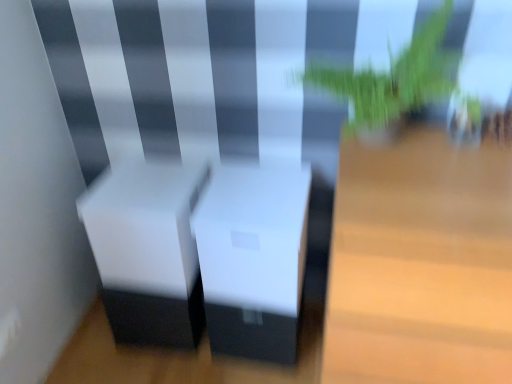
Question: Is white matte table at center, which is counted as the 1th table, starting from the left, to the right of green leafy plant at upper right from the viewer's perspective?

Choices:
 (A) yes
 (B) no

Answer: (B)

Question: Does white matte table at center, which is counted as the 1th table, starting from the left, come in front of green leafy plant at upper right?

Choices:
 (A) yes
 (B) no

Answer: (B)

Question: Can you confirm if white matte table at center, positioned as the second table in right-to-left order, is wider than green leafy plant at upper right?

Choices:
 (A) no
 (B) yes

Answer: (B)

Question: From a real-world perspective, is white matte table at center, which is counted as the 1th table, starting from the left, under green leafy plant at upper right?

Choices:
 (A) no
 (B) yes

Answer: (B)

Question: Is white matte table at center, which is counted as the 1th table, starting from the left, with green leafy plant at upper right?

Choices:
 (A) no
 (B) yes

Answer: (A)

Question: Is point (421, 51) positioned closer to the camera than point (287, 311)?

Choices:
 (A) closer
 (B) farther

Answer: (A)

Question: In the image, is green leafy plant at upper right positioned in front of or behind white matte table at center, which is counted as the 1th table, starting from the left?

Choices:
 (A) front
 (B) behind

Answer: (A)

Question: Considering the positions of green leafy plant at upper right and white matte table at center, positioned as the second table in right-to-left order, in the image, is green leafy plant at upper right taller or shorter than white matte table at center, positioned as the second table in right-to-left order,?

Choices:
 (A) tall
 (B) short

Answer: (A)

Question: Is green leafy plant at upper right bigger or smaller than white matte table at center, positioned as the second table in right-to-left order?

Choices:
 (A) small
 (B) big

Answer: (B)

Question: Relative to light wood table at center, positioned as the second table in left-to-right order, is green leafy plant at upper right in front or behind?

Choices:
 (A) behind
 (B) front

Answer: (A)

Question: Considering the positions of green leafy plant at upper right and light wood table at center, positioned as the second table in left-to-right order, in the image, is green leafy plant at upper right bigger or smaller than light wood table at center, positioned as the second table in left-to-right order,?

Choices:
 (A) small
 (B) big

Answer: (A)

Question: In terms of width, does green leafy plant at upper right look wider or thinner when compared to light wood table at center, positioned as the second table in left-to-right order?

Choices:
 (A) wide
 (B) thin

Answer: (B)

Question: From a real-world perspective, relative to light wood table at center, which is the 1th table in right-to-left order, is green leafy plant at upper right vertically above or below?

Choices:
 (A) above
 (B) below

Answer: (A)

Question: From a real-world perspective, is light wood table at center, positioned as the second table in left-to-right order, physically located above or below white matte table at center, positioned as the second table in right-to-left order?

Choices:
 (A) above
 (B) below

Answer: (B)

Question: Considering the positions of point [467, 185] and point [214, 269], is point [467, 185] closer or farther from the camera than point [214, 269]?

Choices:
 (A) farther
 (B) closer

Answer: (B)